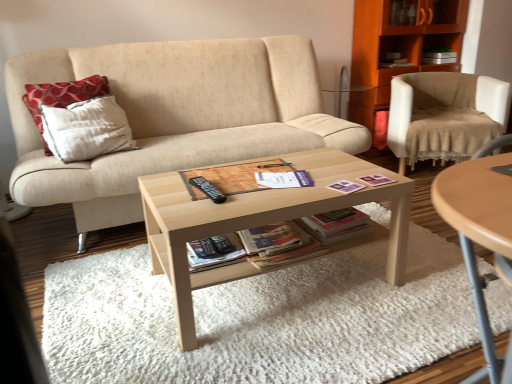
Identify the location of vacant region above light wood/texture coffee table at center (from a real-world perspective). The image size is (512, 384). (271, 180).